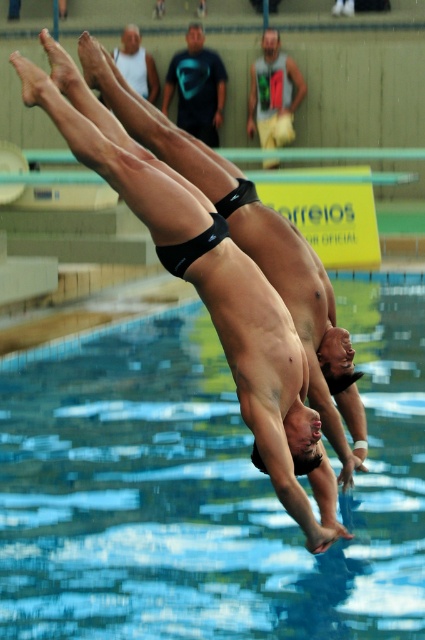
Question: Which is farther from the black matte swim trunks at center?

Choices:
 (A) transparent glass water at center
 (B) black matte t-shirt at upper center
 (C) green fabric shirt at upper center
 (D) white matte tank top at upper center

Answer: (D)

Question: Does green fabric shirt at upper center have a lesser width compared to white matte tank top at upper center?

Choices:
 (A) no
 (B) yes

Answer: (A)

Question: Does green fabric shirt at upper center appear over white matte tank top at upper center?

Choices:
 (A) yes
 (B) no

Answer: (B)

Question: Which point appears closest to the camera in this image?

Choices:
 (A) coord(147,64)
 (B) coord(197,278)

Answer: (B)

Question: Can you confirm if black matte t-shirt at upper center is positioned below green fabric shirt at upper center?

Choices:
 (A) no
 (B) yes

Answer: (A)

Question: Which point is closer to the camera?

Choices:
 (A) white matte tank top at upper center
 (B) black matte swim trunks at center
 (C) green fabric shirt at upper center
 (D) transparent glass water at center

Answer: (B)